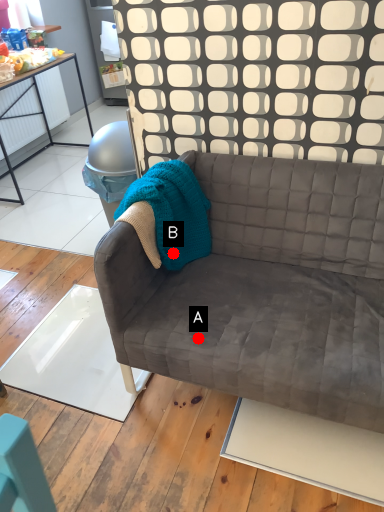
Question: Two points are circled on the image, labeled by A and B beside each circle. Which point is farther from the camera taking this photo?

Choices:
 (A) A is further
 (B) B is further

Answer: (B)